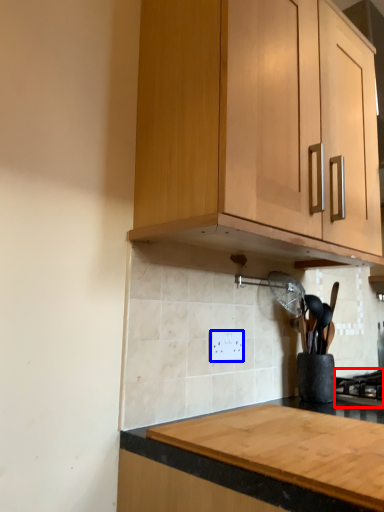
Question: Which object is further to the camera taking this photo, gas stove (highlighted by a red box) or electric outlet (highlighted by a blue box)?

Choices:
 (A) gas stove
 (B) electric outlet

Answer: (A)